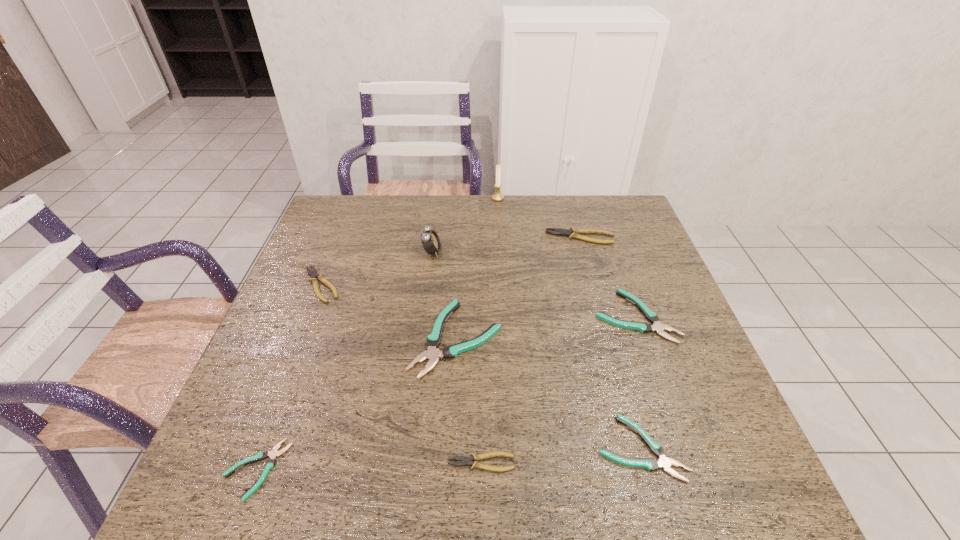
This screenshot has width=960, height=540. In the image, there is a desktop. What are the coordinates of `vacant space at the near edge` in the screenshot? It's located at (430, 505).

Find the location of a particular element. The width and height of the screenshot is (960, 540). free space at the left edge is located at coordinates (342, 286).

Image resolution: width=960 pixels, height=540 pixels. In the image, there is a desktop. Find the location of `free space at the right edge`. free space at the right edge is located at coordinates (678, 427).

The width and height of the screenshot is (960, 540). What are the coordinates of `free region at the far left corner of the desktop` in the screenshot? It's located at pyautogui.click(x=367, y=222).

This screenshot has height=540, width=960. In the image, there is a desktop. In order to click on free space at the near left corner in this screenshot , I will do pos(235,472).

You are a GUI agent. You are given a task and a screenshot of the screen. Output one action in this format:
    pyautogui.click(x=<x>, y=<y>)
    Task: Click on the vacant space at the far right corner of the desktop
    Image resolution: width=960 pixels, height=540 pixels.
    Given the screenshot: What is the action you would take?
    pyautogui.click(x=636, y=234)

Identify the location of free space that is in between the third biggest teal pliers and the farthest object. (569, 323).

Where is `free space between the leftmost yellow pliers and the alarm clock`? This screenshot has height=540, width=960. free space between the leftmost yellow pliers and the alarm clock is located at coordinates (376, 268).

You are a GUI agent. You are given a task and a screenshot of the screen. Output one action in this format:
    pyautogui.click(x=<x>, y=<y>)
    Task: Click on the free point between the leftmost teal pliers and the alarm clock
    The image size is (960, 540).
    Given the screenshot: What is the action you would take?
    pyautogui.click(x=344, y=360)

At what (x,y) coordinates should I click in order to perform the action: click on vacant area that lies between the farthest pliers and the smallest teal pliers. Please return your answer as a coordinate pair (x, y). This screenshot has height=540, width=960. Looking at the image, I should click on (418, 353).